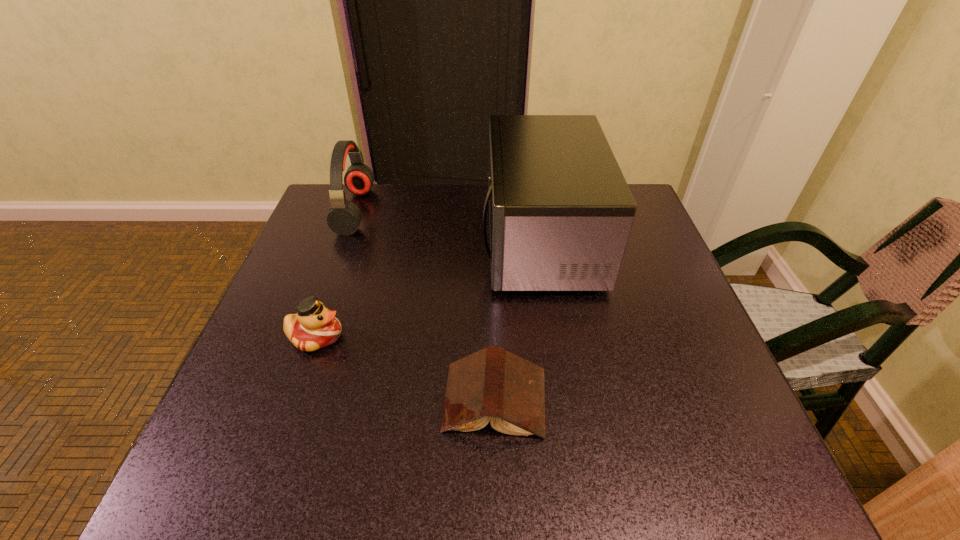
The width and height of the screenshot is (960, 540). I want to click on free space between the second nearest object and the third shortest object, so click(x=336, y=273).

Image resolution: width=960 pixels, height=540 pixels. In order to click on vacant area that lies between the second tallest object and the tallest object in this screenshot , I will do `click(448, 225)`.

Find the location of a particular element. This screenshot has height=540, width=960. free space that is in between the tallest object and the second shortest object is located at coordinates (428, 288).

Locate an element on the screen. Image resolution: width=960 pixels, height=540 pixels. free space that is in between the book and the third farthest object is located at coordinates (405, 368).

Identify the location of object that can be found as the closest to the microwave oven. (492, 384).

Locate which object ranks second in proximity to the second tallest object. Please provide its 2D coordinates. Your answer should be formatted as a tuple, i.e. [(x, y)], where the tuple contains the x and y coordinates of a point satisfying the conditions above.

[(560, 210)]

At what (x,y) coordinates should I click in order to perform the action: click on free space that satisfies the following two spatial constraints: 1. on the ear cups of the third shortest object; 2. on the back side of the shortest object. Please return your answer as a coordinate pair (x, y). The height and width of the screenshot is (540, 960). Looking at the image, I should click on (287, 400).

Identify the location of vacant position in the image that satisfies the following two spatial constraints: 1. on the ear cups of the earphone; 2. on the left side of the book. Image resolution: width=960 pixels, height=540 pixels. (287, 400).

I want to click on vacant space that satisfies the following two spatial constraints: 1. on the face of the nearest object; 2. on the left side of the second nearest object, so click(294, 400).

Identify the location of vacant position in the image that satisfies the following two spatial constraints: 1. on the face of the third farthest object; 2. on the back side of the shortest object. The width and height of the screenshot is (960, 540). (294, 400).